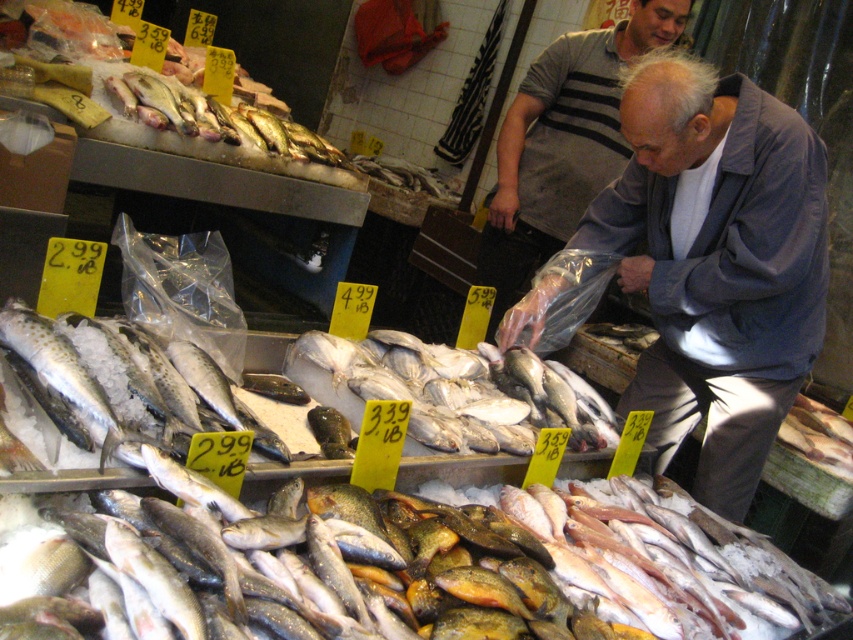
Question: Can you confirm if shiny silver fish at lower center is positioned below shiny silver fish at upper left?

Choices:
 (A) yes
 (B) no

Answer: (A)

Question: Does speckled silver fish at center appear under shiny silver fish at upper left?

Choices:
 (A) no
 (B) yes

Answer: (B)

Question: Which point appears closest to the camera in this image?

Choices:
 (A) (471, 380)
 (B) (549, 186)
 (C) (648, 625)

Answer: (C)

Question: Considering the real-world distances, which object is closest to the white matte fish at center?

Choices:
 (A) shiny silver fish at lower center
 (B) shiny silver fish at upper left
 (C) gray striped shirt at center

Answer: (A)

Question: Which point is farther to the camera?

Choices:
 (A) (170, 113)
 (B) (144, 396)
 (C) (570, 189)

Answer: (C)

Question: Is gray fabric jacket at center behind white matte fish at center?

Choices:
 (A) yes
 (B) no

Answer: (A)